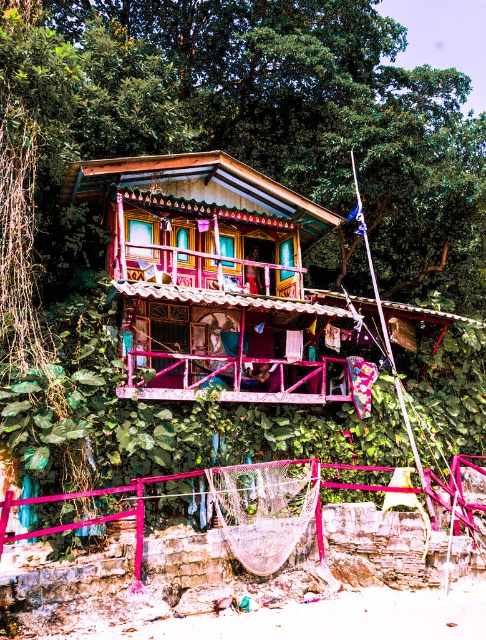
You are standing at the base of the house and want to locate two specific points marked in the image. The first point is at coordinates point (279, 477) and the second is at point (142, 388). Which of these two points is closer to you?

Point (142, 388) is closer to you because it is in front of point (279, 477).